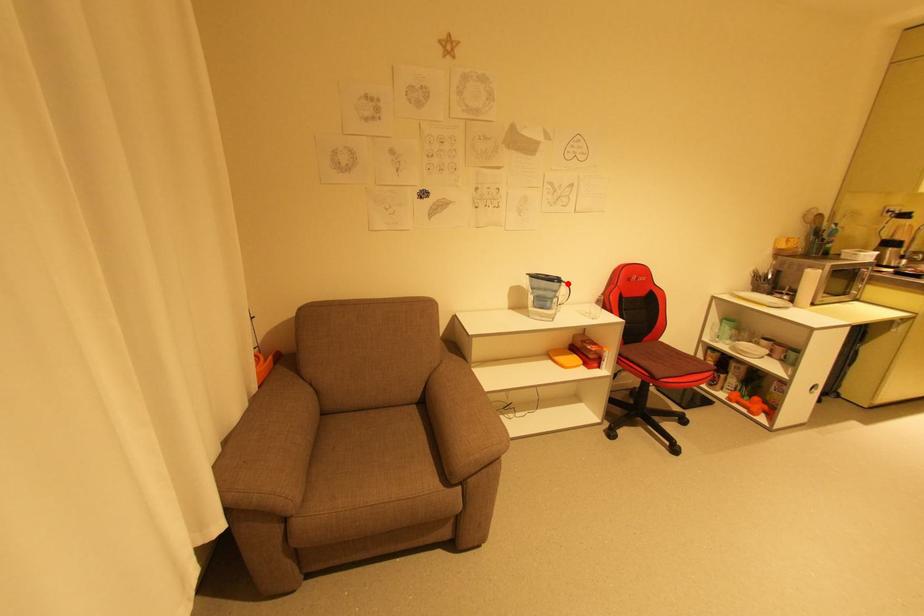
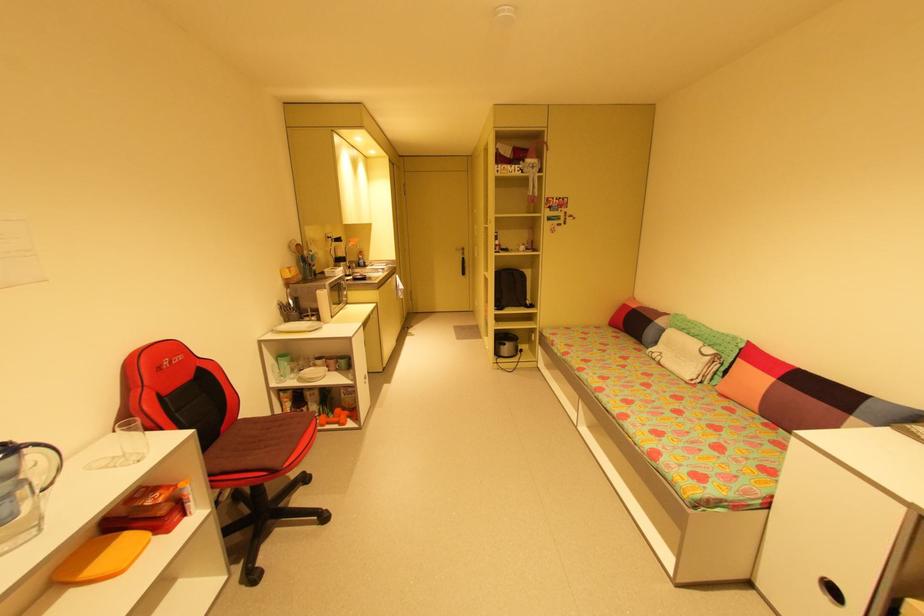
The point at the highlighted location is marked in the first image. Where is the corresponding point in the second image?

(30, 450)